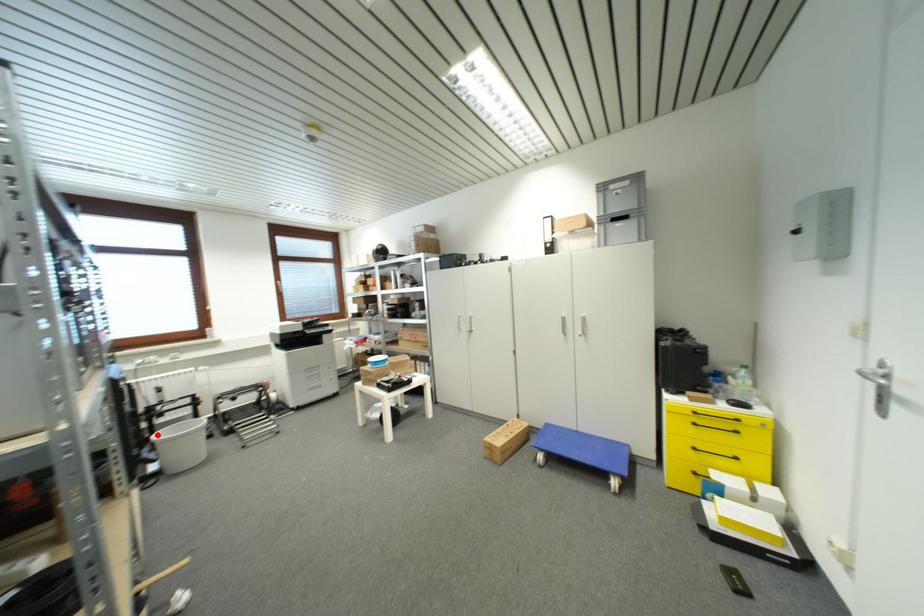
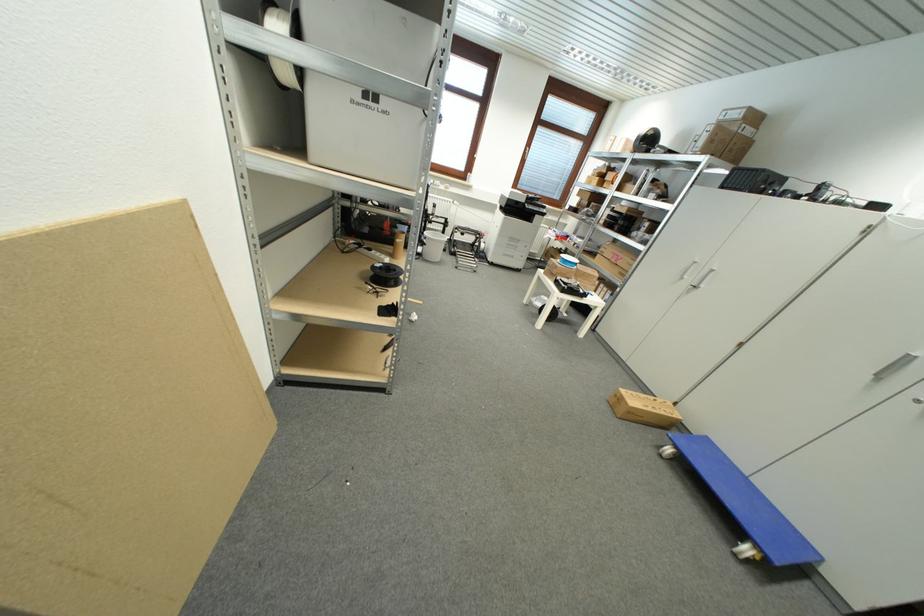
Question: I am providing you with two images of the same scene from different viewpoints. Image1 has a red point marked. In image2, the corresponding 3D location appears at what relative position? Reply with the corresponding letter.

Choices:
 (A) Closer
 (B) Farther

Answer: (A)